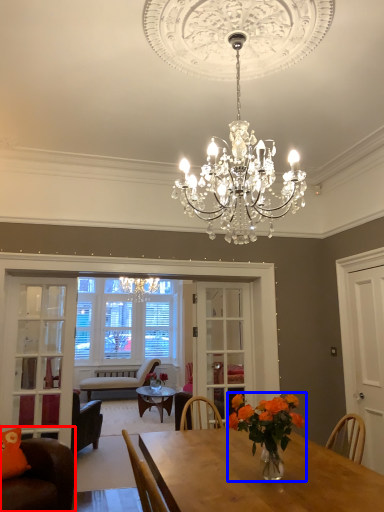
Question: Among these objects, which one is farthest to the camera, chair (highlighted by a red box) or floral arrangement (highlighted by a blue box)?

Choices:
 (A) chair
 (B) floral arrangement

Answer: (A)